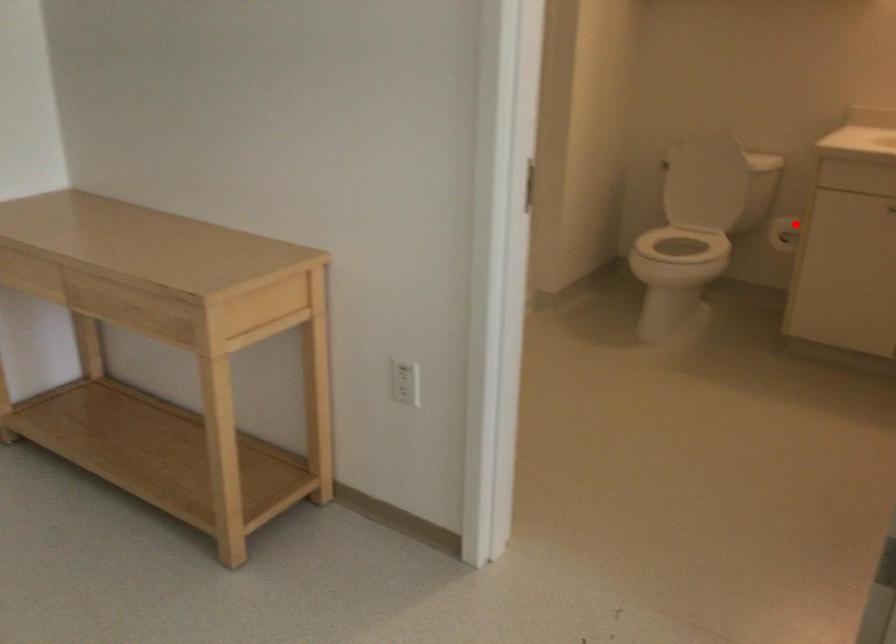
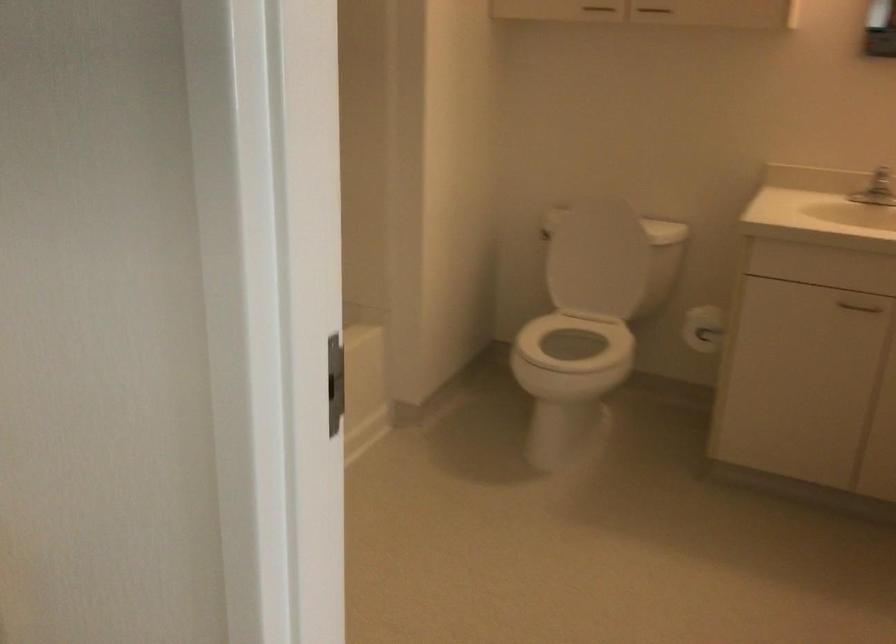
Where in the second image is the point corresponding to the highlighted location from the first image?

(702, 328)